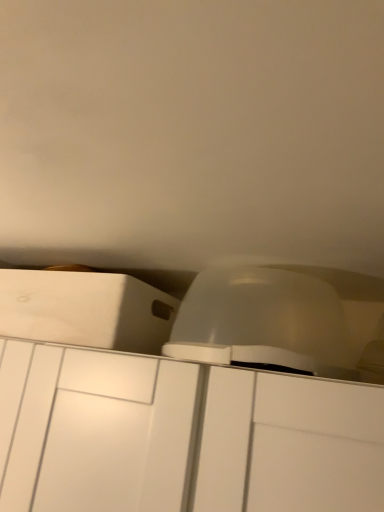
Where is `vacant area on top of transparent plastic dome at center (from a real-world perspective)`? This screenshot has height=512, width=384. vacant area on top of transparent plastic dome at center (from a real-world perspective) is located at coordinates (269, 261).